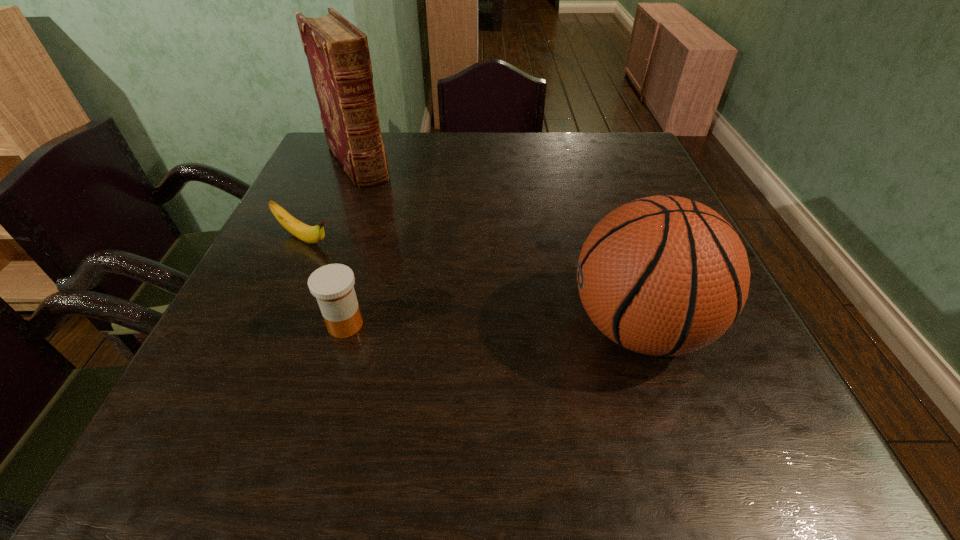
What are the coordinates of `medicine` in the screenshot? It's located at (333, 285).

At what (x,y) coordinates should I click in order to perform the action: click on the third shortest object. Please return your answer as a coordinate pair (x, y). The width and height of the screenshot is (960, 540). Looking at the image, I should click on (663, 275).

In order to click on the rightmost object in this screenshot , I will do `click(663, 275)`.

Locate an element on the screen. The width and height of the screenshot is (960, 540). hardback book is located at coordinates (338, 56).

The image size is (960, 540). I want to click on the farthest object, so (x=338, y=56).

Locate an element on the screen. The width and height of the screenshot is (960, 540). the third nearest object is located at coordinates (310, 234).

Locate an element on the screen. The height and width of the screenshot is (540, 960). banana is located at coordinates (310, 234).

Identify the location of vacant space situated 0.050m on the label of the third tallest object. (334, 364).

The image size is (960, 540). What are the coordinates of `free location located on the side where the inflation valve is located` in the screenshot? It's located at (469, 327).

You are a GUI agent. You are given a task and a screenshot of the screen. Output one action in this format:
    pyautogui.click(x=<x>, y=<y>)
    Task: Click on the vacant space located on the side where the inflation valve is located
    The height and width of the screenshot is (540, 960).
    Given the screenshot: What is the action you would take?
    pyautogui.click(x=349, y=327)